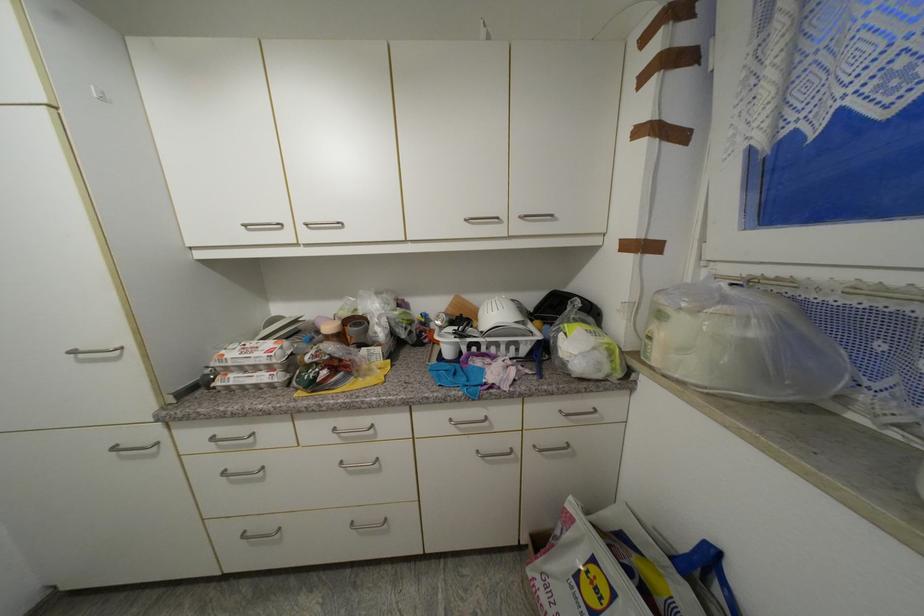
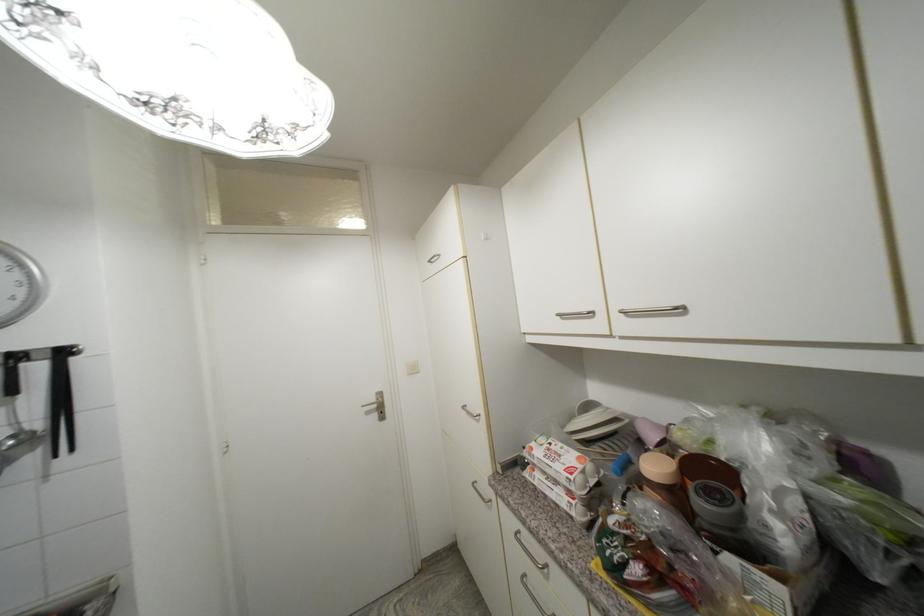
Find the pixel in the second image that matches (360,326) in the first image.

(714, 496)